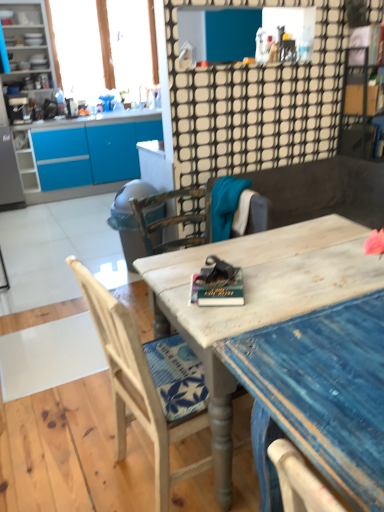
Find the location of a particular element. blank space above distressed wood desk at center (from a real-world perspective) is located at coordinates (292, 255).